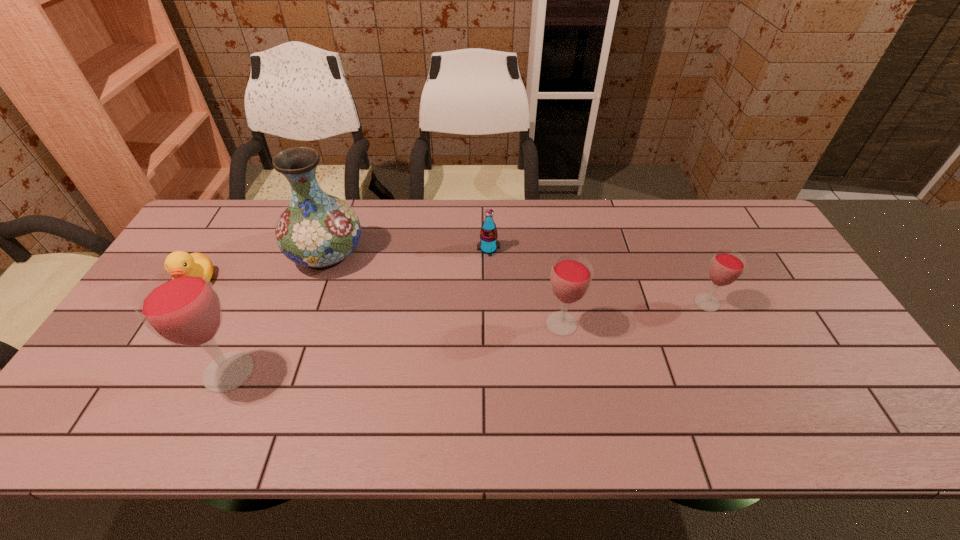
Locate an element on the screen. The image size is (960, 540). vacant position in the image that satisfies the following two spatial constraints: 1. at the beak of the shortest object; 2. on the left side of the nearest wineglass is located at coordinates (143, 372).